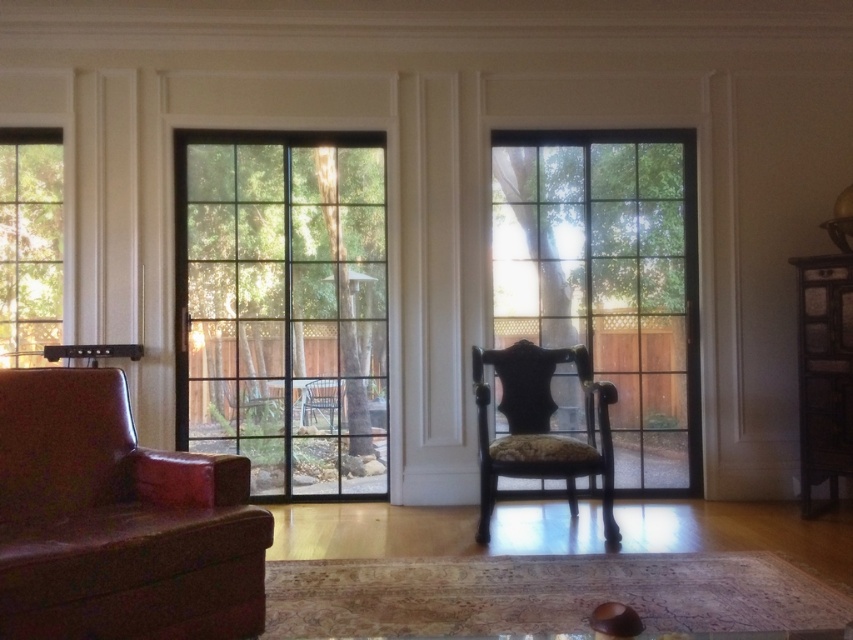
Question: Which is nearer to the clear glass screen door at center?

Choices:
 (A) wooden cabinet at right
 (B) clear glass window at center
 (C) clear glass window at left

Answer: (C)

Question: Which point is farther from the camera taking this photo?

Choices:
 (A) (189, 627)
 (B) (541, 205)
 (C) (816, 401)
 (D) (35, 221)

Answer: (B)

Question: Estimate the real-world distances between objects in this image. Which object is closer to the clear glass window at left?

Choices:
 (A) wooden cabinet at right
 (B) clear glass window at center

Answer: (B)

Question: Is clear glass screen door at center bigger than clear glass window at center?

Choices:
 (A) yes
 (B) no

Answer: (A)

Question: Considering the relative positions of dark wood armchair at center and clear glass window at left in the image provided, where is dark wood armchair at center located with respect to clear glass window at left?

Choices:
 (A) right
 (B) left

Answer: (A)

Question: Does clear glass window at center have a smaller size compared to leather armchair at left?

Choices:
 (A) yes
 (B) no

Answer: (A)